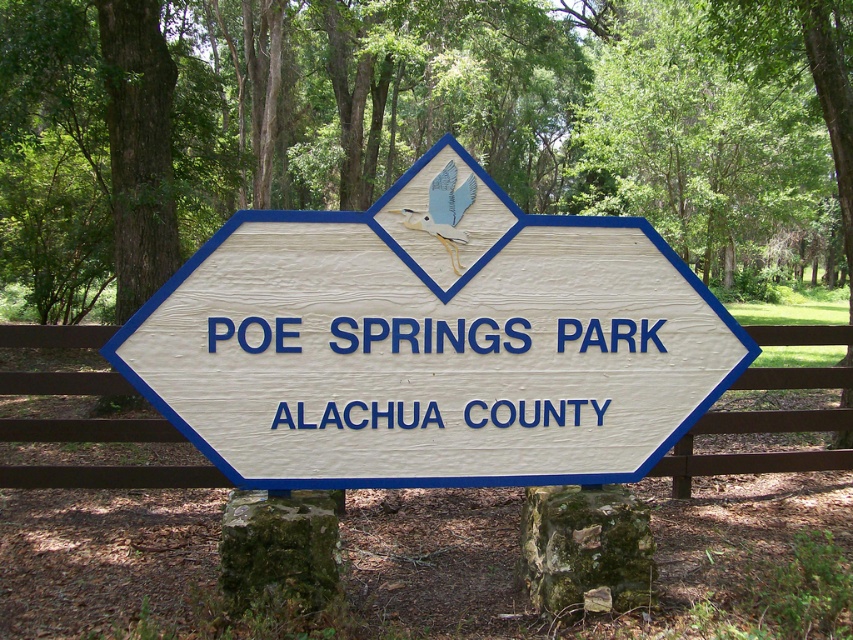
You are planning to take a photo of the wooden sign at center and the brown wooden fence at center from a distance. Which object will appear wider in the photo?

The wooden sign at center will appear wider in the photo because its width is larger than that of the brown wooden fence at center.

Where is the wooden sign at center located in the image?

The wooden sign at center is located at point (431,342).

You are standing at the entrance of Poe Springs Park and notice two points marked on the sign. The first point is at coordinates point (x=262, y=371) and the second is at point (x=821, y=332). Based on their positions, which point is closer to you?

Point (x=262, y=371) is in front of point (x=821, y=332), so it is closer to you.